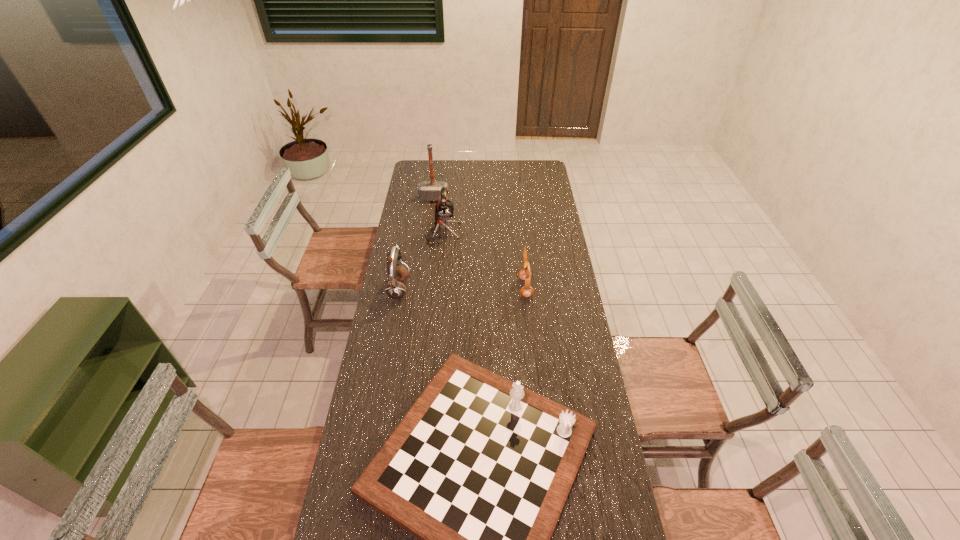
In order to click on the tallest object in this screenshot , I will do `click(428, 190)`.

Where is `the farthest object`? the farthest object is located at coordinates (428, 190).

Locate an element on the screen. This screenshot has width=960, height=540. the second earphone from left to right is located at coordinates (444, 210).

Find the location of a particular element. the farthest earphone is located at coordinates (444, 210).

Find the location of a particular element. Image resolution: width=960 pixels, height=540 pixels. the leftmost earphone is located at coordinates (395, 289).

Identify the location of the shortest earphone. This screenshot has width=960, height=540. (525, 274).

Where is `vacant space located on the striking surface of the tallest object`? This screenshot has height=540, width=960. vacant space located on the striking surface of the tallest object is located at coordinates (431, 221).

Locate an element on the screen. This screenshot has width=960, height=540. vacant region located 0.070m on the left of the fourth nearest object is located at coordinates (411, 233).

Identify the location of vacant space located on the ear pads of the leftmost earphone. Image resolution: width=960 pixels, height=540 pixels. (428, 289).

Where is `vacant space located on the front-facing side of the rightmost earphone`? The image size is (960, 540). vacant space located on the front-facing side of the rightmost earphone is located at coordinates (466, 288).